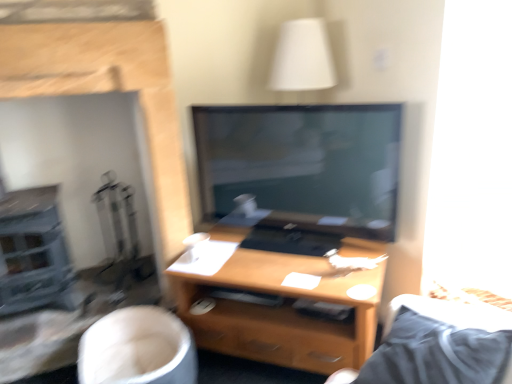
Question: From a real-world perspective, is white fabric swivel chair at lower left positioned above or below wooden desk at center?

Choices:
 (A) below
 (B) above

Answer: (A)

Question: In the image, is white fabric swivel chair at lower left positioned in front of or behind wooden desk at center?

Choices:
 (A) front
 (B) behind

Answer: (A)

Question: Considering the real-world distances, which object is closest to the wooden desk at center?

Choices:
 (A) smooth stone fireplace at left
 (B) white fabric swivel chair at lower left

Answer: (B)

Question: Which of these objects is positioned closest to the smooth stone fireplace at left?

Choices:
 (A) white fabric swivel chair at lower left
 (B) wooden desk at center

Answer: (A)